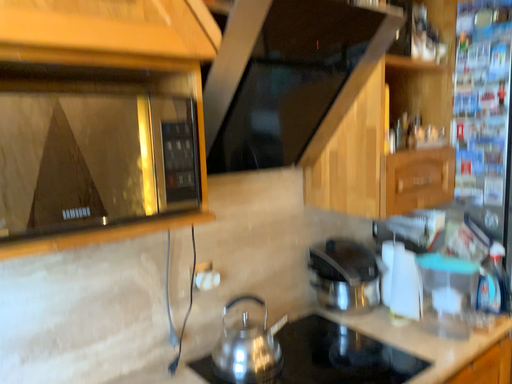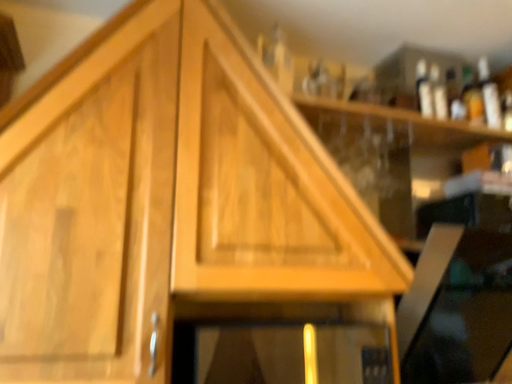
Question: How did the camera likely rotate when shooting the video?

Choices:
 (A) rotated right
 (B) rotated left

Answer: (B)